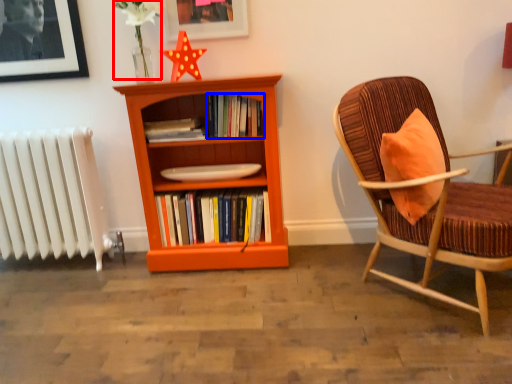
Question: Among these objects, which one is nearest to the camera, flower (highlighted by a red box) or book (highlighted by a blue box)?

Choices:
 (A) flower
 (B) book

Answer: (A)